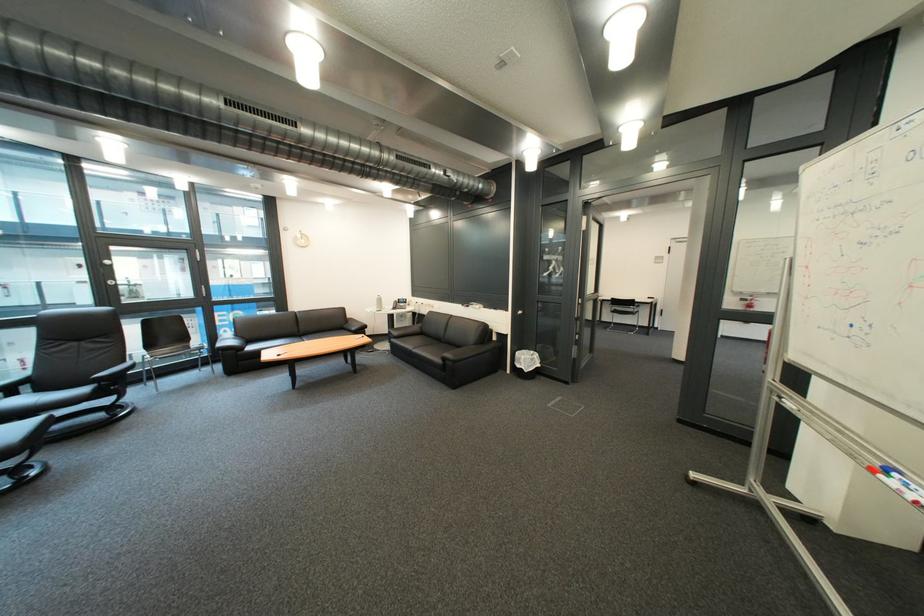
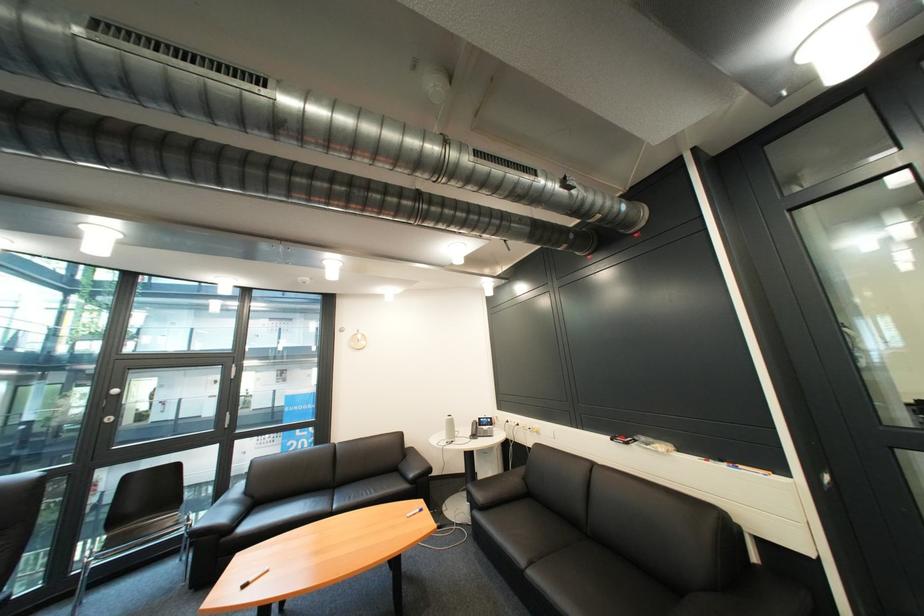
Find the pixel in the second image that matches the point at 411,301 in the first image.

(492, 419)